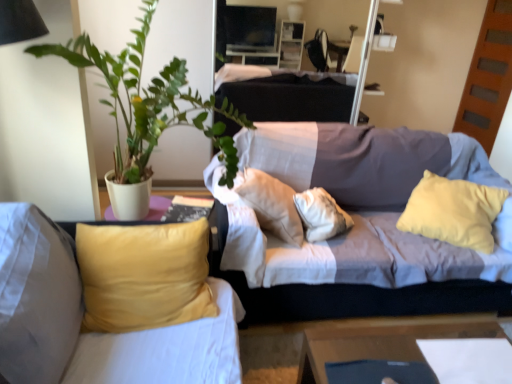
The width and height of the screenshot is (512, 384). Describe the element at coordinates (380, 342) in the screenshot. I see `wooden table at lower right` at that location.

Identify the location of wooden table at lower right. (380, 342).

Image resolution: width=512 pixels, height=384 pixels. What do you see at coordinates (82, 316) in the screenshot? I see `velvet yellow pillow at left, the 1th studio couch positioned from the left` at bounding box center [82, 316].

In order to face textured gray couch at center, the 1th studio couch from the right, should I rotate leftwards or rightwards?

You should look right and rotate roughly 15.518 degrees.

Identify the location of wooden table at lower right. (380, 342).

Does velvet yellow pillow at left, the 1th studio couch positioned from the left, touch wooden table at lower right?

There is a gap between velvet yellow pillow at left, the 1th studio couch positioned from the left, and wooden table at lower right.

From a real-world perspective, is velvet yellow pillow at left, the 1th studio couch positioned from the left, on top of wooden table at lower right?

Yes.

How many degrees apart are the facing directions of velvet yellow pillow at left, the 1th studio couch positioned from the left, and wooden table at lower right?

velvet yellow pillow at left, the 1th studio couch positioned from the left, and wooden table at lower right are facing 0.569 degrees away from each other.

Is velvet yellow pillow at left, the 1th studio couch positioned from the left, bigger or smaller than wooden table at lower right?

Considering their sizes, velvet yellow pillow at left, the 1th studio couch positioned from the left, takes up more space than wooden table at lower right.

Is green leafy plant at upper left wider or thinner than wooden table at lower right?

green leafy plant at upper left is wider than wooden table at lower right.

Is green leafy plant at upper left in contact with wooden table at lower right?

They are not placed beside each other.

From the image's perspective, which one is positioned lower, green leafy plant at upper left or wooden table at lower right?

From the image's view, wooden table at lower right is below.

How many degrees apart are the facing directions of green leafy plant at upper left and wooden table at lower right?

The facing directions of green leafy plant at upper left and wooden table at lower right are 0.00016 degrees apart.

Is textured gray couch at center, which is counted as the 2th studio couch, starting from the left, situated inside green leafy plant at upper left or outside?

textured gray couch at center, which is counted as the 2th studio couch, starting from the left, exists outside the volume of green leafy plant at upper left.

Is textured gray couch at center, which is counted as the 2th studio couch, starting from the left, to the right of green leafy plant at upper left from the viewer's perspective?

Yes, textured gray couch at center, which is counted as the 2th studio couch, starting from the left, is to the right of green leafy plant at upper left.

The height and width of the screenshot is (384, 512). Find the location of `studio couch that is the 1st object located below the green leafy plant at upper left (from the image's perspective)`. studio couch that is the 1st object located below the green leafy plant at upper left (from the image's perspective) is located at coordinates (360, 227).

Would you consider textured gray couch at center, the 1th studio couch from the right, to be distant from green leafy plant at upper left?

textured gray couch at center, the 1th studio couch from the right, is near green leafy plant at upper left, not far away.

From the image's perspective, is textured gray couch at center, which is counted as the 2th studio couch, starting from the left, below velvet yellow pillow at left, which ranks as the 2th studio couch in right-to-left order?

No.

Is textured gray couch at center, which is counted as the 2th studio couch, starting from the left, next to velvet yellow pillow at left, which ranks as the 2th studio couch in right-to-left order, and touching it?

No, textured gray couch at center, which is counted as the 2th studio couch, starting from the left, is not with velvet yellow pillow at left, which ranks as the 2th studio couch in right-to-left order.

Can you confirm if textured gray couch at center, which is counted as the 2th studio couch, starting from the left, is smaller than velvet yellow pillow at left, which ranks as the 2th studio couch in right-to-left order?

Actually, textured gray couch at center, which is counted as the 2th studio couch, starting from the left, might be larger than velvet yellow pillow at left, which ranks as the 2th studio couch in right-to-left order.

Which object is closer to the camera, textured gray couch at center, which is counted as the 2th studio couch, starting from the left, or velvet yellow pillow at left, the 1th studio couch positioned from the left?

velvet yellow pillow at left, the 1th studio couch positioned from the left, is more forward.

Is the surface of wooden table at lower right in direct contact with textured gray couch at center, the 1th studio couch from the right?

wooden table at lower right and textured gray couch at center, the 1th studio couch from the right, are clearly separated.

Who is shorter, wooden table at lower right or textured gray couch at center, which is counted as the 2th studio couch, starting from the left?

With less height is wooden table at lower right.

Do you think wooden table at lower right is within textured gray couch at center, which is counted as the 2th studio couch, starting from the left, or outside of it?

wooden table at lower right is located beyond the bounds of textured gray couch at center, which is counted as the 2th studio couch, starting from the left.

Is wooden table at lower right positioned with its back to textured gray couch at center, which is counted as the 2th studio couch, starting from the left?

Yes, wooden table at lower right is positioned with its back facing textured gray couch at center, which is counted as the 2th studio couch, starting from the left.

Are wooden table at lower right and green leafy plant at upper left far apart?

Absolutely, wooden table at lower right is distant from green leafy plant at upper left.

Is point (449, 324) behind point (134, 61)?

No, (449, 324) is in front of (134, 61).

From the image's perspective, between wooden table at lower right and green leafy plant at upper left, which one is located above?

From the image's view, green leafy plant at upper left is above.

Is wooden table at lower right bigger than green leafy plant at upper left?

No, wooden table at lower right is not bigger than green leafy plant at upper left.

From a real-world perspective, count 1st studio couchs upward from the wooden table at lower right and point to it. Please provide its 2D coordinates.

[(360, 227)]

Image resolution: width=512 pixels, height=384 pixels. I want to click on table that appears below the velvet yellow pillow at left, the 1th studio couch positioned from the left (from a real-world perspective), so click(380, 342).

At what (x,y) coordinates should I click in order to perform the action: click on houseplant located above the wooden table at lower right (from a real-world perspective). Please return your answer as a coordinate pair (x, y). Looking at the image, I should click on (148, 103).

From the image, which object appears to be nearer to velvet yellow pillow at left, which ranks as the 2th studio couch in right-to-left order, green leafy plant at upper left or wooden table at lower right?

wooden table at lower right is closer to velvet yellow pillow at left, which ranks as the 2th studio couch in right-to-left order.

Consider the image. From the image, which object appears to be farther from green leafy plant at upper left, textured gray couch at center, which is counted as the 2th studio couch, starting from the left, or velvet yellow pillow at left, the 1th studio couch positioned from the left?

velvet yellow pillow at left, the 1th studio couch positioned from the left.

Considering their positions, is textured gray couch at center, which is counted as the 2th studio couch, starting from the left, positioned closer to wooden table at lower right than velvet yellow pillow at left, which ranks as the 2th studio couch in right-to-left order?

Among the two, textured gray couch at center, which is counted as the 2th studio couch, starting from the left, is located nearer to wooden table at lower right.

Consider the image. Considering their positions, is velvet yellow pillow at left, which ranks as the 2th studio couch in right-to-left order, positioned further to wooden table at lower right than green leafy plant at upper left?

Among the two, green leafy plant at upper left is located further to wooden table at lower right.

Considering their positions, is textured gray couch at center, the 1th studio couch from the right, positioned closer to wooden table at lower right than green leafy plant at upper left?

textured gray couch at center, the 1th studio couch from the right, is positioned closer to the anchor wooden table at lower right.

Estimate the real-world distances between objects in this image. Which object is closer to textured gray couch at center, which is counted as the 2th studio couch, starting from the left, velvet yellow pillow at left, the 1th studio couch positioned from the left, or green leafy plant at upper left?

The object closer to textured gray couch at center, which is counted as the 2th studio couch, starting from the left, is green leafy plant at upper left.

Estimate the real-world distances between objects in this image. Which object is further from velvet yellow pillow at left, which ranks as the 2th studio couch in right-to-left order, textured gray couch at center, the 1th studio couch from the right, or wooden table at lower right?

textured gray couch at center, the 1th studio couch from the right, lies further to velvet yellow pillow at left, which ranks as the 2th studio couch in right-to-left order, than the other object.

Considering their positions, is textured gray couch at center, which is counted as the 2th studio couch, starting from the left, positioned further to green leafy plant at upper left than wooden table at lower right?

Based on the image, wooden table at lower right appears to be further to green leafy plant at upper left.

The image size is (512, 384). What are the coordinates of `houseplant situated between velvet yellow pillow at left, the 1th studio couch positioned from the left, and textured gray couch at center, the 1th studio couch from the right, from left to right` in the screenshot? It's located at (148, 103).

Locate an element on the screen. houseplant located between velvet yellow pillow at left, the 1th studio couch positioned from the left, and wooden table at lower right in the left-right direction is located at coordinates (148, 103).

The width and height of the screenshot is (512, 384). I want to click on table between green leafy plant at upper left and textured gray couch at center, which is counted as the 2th studio couch, starting from the left, so click(x=380, y=342).

You are a GUI agent. You are given a task and a screenshot of the screen. Output one action in this format:
    pyautogui.click(x=<x>, y=<y>)
    Task: Click on the table between velvet yellow pillow at left, which ranks as the 2th studio couch in right-to-left order, and textured gray couch at center, which is counted as the 2th studio couch, starting from the left, in the horizontal direction
    
    Given the screenshot: What is the action you would take?
    pyautogui.click(x=380, y=342)